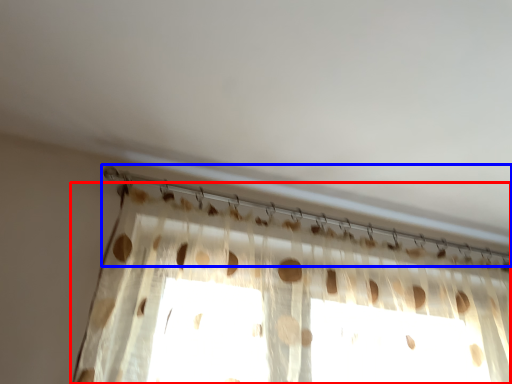
Question: Among these objects, which one is nearest to the camera, curtain (highlighted by a red box) or clothesline (highlighted by a blue box)?

Choices:
 (A) curtain
 (B) clothesline

Answer: (A)